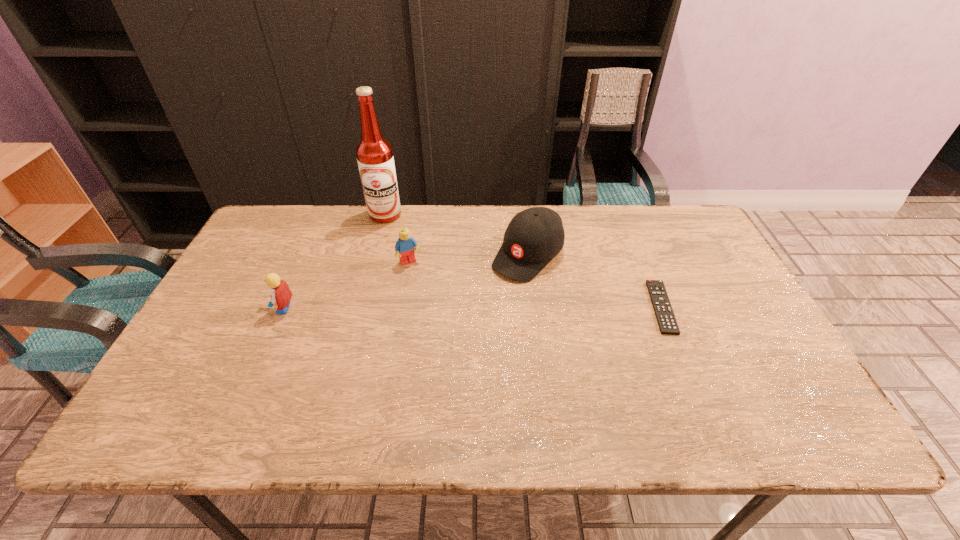
You are a GUI agent. You are given a task and a screenshot of the screen. Output one action in this format:
    pyautogui.click(x=<x>, y=<y>)
    Task: Click on the vacant area between the farthest object and the nearer Lego
    The height and width of the screenshot is (540, 960).
    Given the screenshot: What is the action you would take?
    pyautogui.click(x=334, y=261)

Identify the location of unoccupied area between the leftmost object and the second object from right to left. The width and height of the screenshot is (960, 540). (405, 282).

Image resolution: width=960 pixels, height=540 pixels. Find the location of `empty location between the farther Lego and the remote control`. empty location between the farther Lego and the remote control is located at coordinates (536, 285).

At what (x,y) coordinates should I click in order to perform the action: click on vacant space that is in between the tallest object and the baseball cap. Please return your answer as a coordinate pair (x, y). The height and width of the screenshot is (540, 960). Looking at the image, I should click on (457, 235).

Find the location of a particular element. vacant region between the shortest object and the right Lego is located at coordinates (536, 285).

Where is `vacant area that lies between the leftmost object and the remote control`? vacant area that lies between the leftmost object and the remote control is located at coordinates (472, 308).

Where is `empty location between the second object from right to left and the farther Lego`? This screenshot has height=540, width=960. empty location between the second object from right to left and the farther Lego is located at coordinates (468, 259).

Where is `empty location between the baseball cap and the farthest object`? The width and height of the screenshot is (960, 540). empty location between the baseball cap and the farthest object is located at coordinates (457, 235).

Find the location of a particular element. empty location between the tallest object and the second object from right to left is located at coordinates (457, 235).

Locate an element on the screen. free space between the baseball cap and the farther Lego is located at coordinates (468, 259).